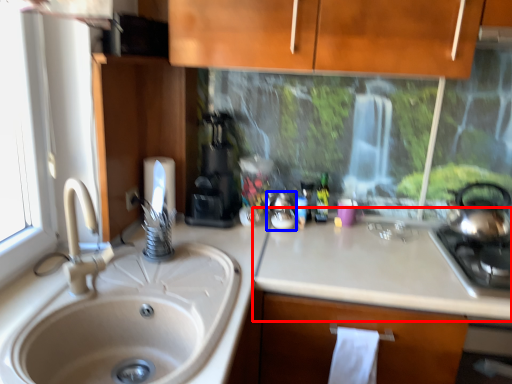
Question: Which of the following is the farthest to the observer, counter top (highlighted by a red box) or appliance (highlighted by a blue box)?

Choices:
 (A) counter top
 (B) appliance

Answer: (B)